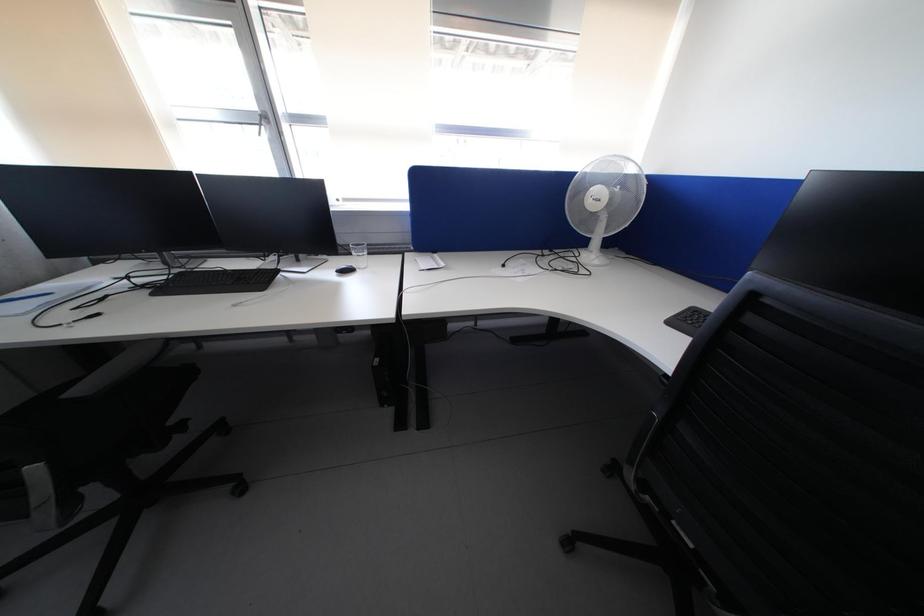
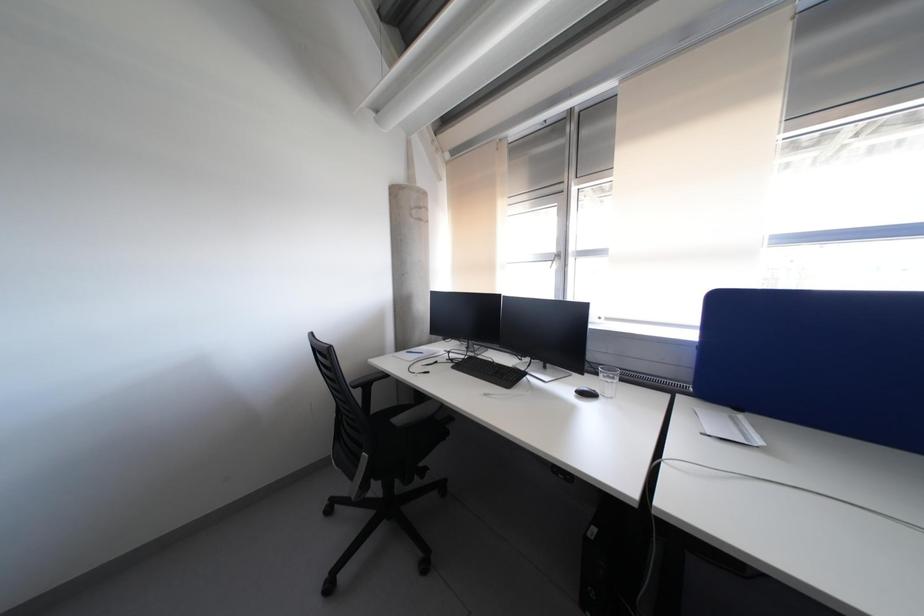
Question: Based on the continuous images, in which direction is the camera rotating? Reply with the corresponding letter.

Choices:
 (A) Left
 (B) Right
 (C) Up
 (D) Down

Answer: (A)